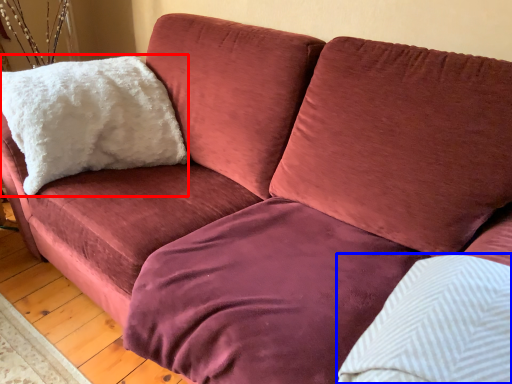
Question: Which object appears farthest to the camera in this image, pillow (highlighted by a red box) or pillow (highlighted by a blue box)?

Choices:
 (A) pillow
 (B) pillow

Answer: (A)